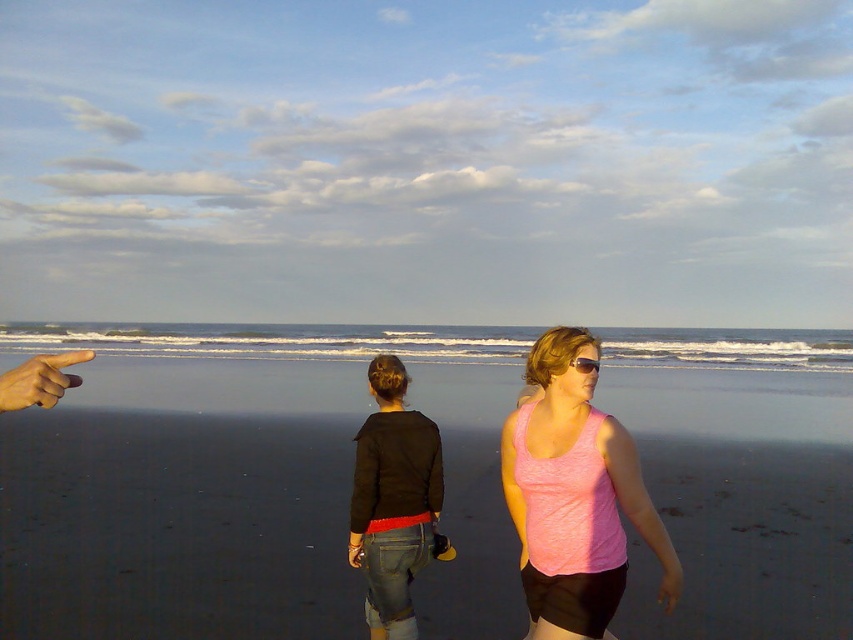
You are a photographer trying to capture the two people on the beach. You notice the pink fabric tank top at center and the pink matte sunglasses at center. Which object should you focus on to ensure it fits entirely within your camera frame if your frame can only accommodate the width of the smaller object?

The pink matte sunglasses at center has a smaller width compared to the pink fabric tank top at center. Therefore, to ensure it fits entirely within the camera frame, you should focus on the pink matte sunglasses at center.

You are a photographer trying to capture the perfect shot of the beach scene. You want to include the skinny tan finger at upper left in your composition. Where should you position your camera to ensure the finger is centered in the frame?

To center the skinny tan finger at upper left in your frame, position your camera so the finger aligns with the center point at coordinates approximately 0.595 on the x and 0.047 on the y axis.

You are a photographer trying to capture a wide shot of the beach scene. Given that the smooth sand at center is larger in size than the pink fabric tank top at center, which object should you focus on to ensure both are in frame without cropping?

You should focus on the smooth sand at center since it is larger in size than the pink fabric tank top at center, ensuring both fit within the frame without cropping.